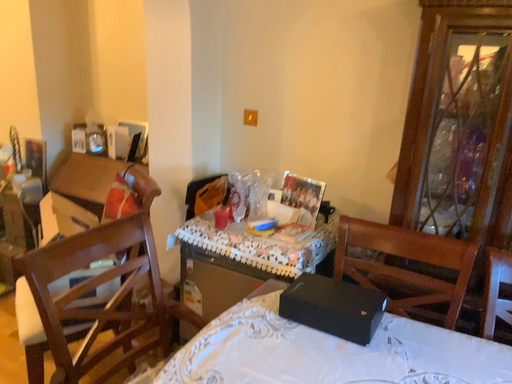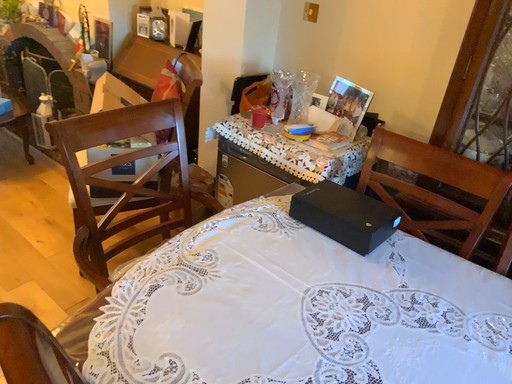
Question: Which way did the camera rotate in the video?

Choices:
 (A) rotated downward
 (B) rotated upward

Answer: (A)